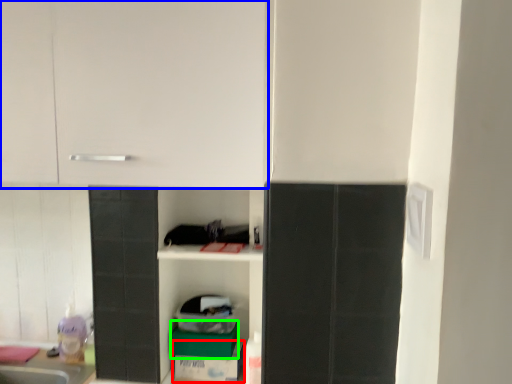
Question: Which object is the closest to the cardboard box (highlighted by a red box)? Choose among these: cabinetry (highlighted by a blue box) or cardboard box (highlighted by a green box).

Choices:
 (A) cabinetry
 (B) cardboard box

Answer: (B)